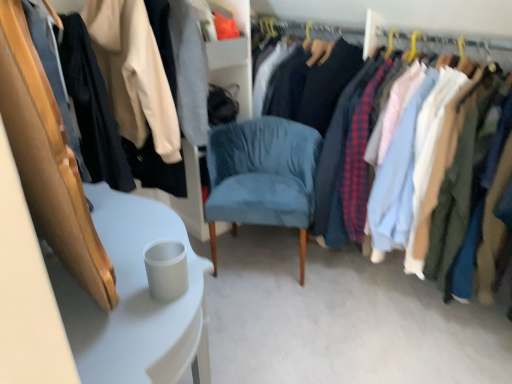
Find the location of a particular element. matte black jacket at upper left, positioned as the 1th closet in left-to-right order is located at coordinates (48, 161).

In order to face matte black jacket at upper left, the second closet from the right, should I rotate leftwards or rightwards?

To align with it, rotate left about 16.623°.

What do you see at coordinates (262, 176) in the screenshot?
I see `suede blue chair at center` at bounding box center [262, 176].

At what (x,y) coordinates should I click in order to perform the action: click on matte fabric shirts at right, the 2th closet when ordered from left to right. Please return your answer as a coordinate pair (x, y). Looking at the image, I should click on (471, 194).

Based on the photo, which is correct: matte fabric shirts at right, the 2th closet when ordered from left to right, is inside white glossy table at lower left, or outside of it?

matte fabric shirts at right, the 2th closet when ordered from left to right, is not inside white glossy table at lower left, it's outside.

Visually, is matte fabric shirts at right, the 1th closet viewed from the right, positioned to the left or to the right of white glossy table at lower left?

In the image, matte fabric shirts at right, the 1th closet viewed from the right, appears on the right side of white glossy table at lower left.

At what (x,y) coordinates should I click in order to perform the action: click on table below the matte black jacket at upper left, the second closet from the right (from a real-world perspective). Please return your answer as a coordinate pair (x, y). This screenshot has height=384, width=512. Looking at the image, I should click on (134, 300).

Is matte black jacket at upper left, the second closet from the right, positioned behind white glossy table at lower left?

Yes, it is behind white glossy table at lower left.

Considering the relative sizes of matte black jacket at upper left, positioned as the 1th closet in left-to-right order, and white glossy table at lower left in the image provided, is matte black jacket at upper left, positioned as the 1th closet in left-to-right order, shorter than white glossy table at lower left?

No.

Is point (316, 163) less distant than point (162, 375)?

No.

Is suede blue chair at center wider than white glossy table at lower left?

Yes, suede blue chair at center is wider than white glossy table at lower left.

Between suede blue chair at center and white glossy table at lower left, which one appears on the left side from the viewer's perspective?

Positioned to the left is white glossy table at lower left.

Are suede blue chair at center and white glossy table at lower left located far from each other?

suede blue chair at center is actually quite close to white glossy table at lower left.

From the image's perspective, between matte fabric shirts at right, the 1th closet viewed from the right, and suede blue chair at center, who is located below?

suede blue chair at center, from the image's perspective.

From a real-world perspective, which is physically above, matte fabric shirts at right, the 1th closet viewed from the right, or suede blue chair at center?

matte fabric shirts at right, the 1th closet viewed from the right.

How many degrees apart are the facing directions of matte fabric shirts at right, the 2th closet when ordered from left to right, and suede blue chair at center?

The angle between the facing direction of matte fabric shirts at right, the 2th closet when ordered from left to right, and the facing direction of suede blue chair at center is 43.8 degrees.

Is suede blue chair at center a part of matte fabric shirts at right, the 2th closet when ordered from left to right?

No, matte fabric shirts at right, the 2th closet when ordered from left to right, does not contain suede blue chair at center.

From a real-world perspective, who is located lower, matte black jacket at upper left, the second closet from the right, or matte fabric shirts at right, the 2th closet when ordered from left to right?

matte fabric shirts at right, the 2th closet when ordered from left to right, from a real-world perspective.

Is matte black jacket at upper left, the second closet from the right, oriented towards matte fabric shirts at right, the 2th closet when ordered from left to right?

No.

Based on their positions, is matte black jacket at upper left, the second closet from the right, located to the left or right of matte fabric shirts at right, the 1th closet viewed from the right?

From the image, it's evident that matte black jacket at upper left, the second closet from the right, is to the left of matte fabric shirts at right, the 1th closet viewed from the right.

Considering the sizes of matte black jacket at upper left, positioned as the 1th closet in left-to-right order, and matte fabric shirts at right, the 2th closet when ordered from left to right, in the image, is matte black jacket at upper left, positioned as the 1th closet in left-to-right order, wider or thinner than matte fabric shirts at right, the 2th closet when ordered from left to right,?

Clearly, matte black jacket at upper left, positioned as the 1th closet in left-to-right order, has less width compared to matte fabric shirts at right, the 2th closet when ordered from left to right.

Which object is closer to the camera taking this photo, suede blue chair at center or matte fabric shirts at right, the 1th closet viewed from the right?

matte fabric shirts at right, the 1th closet viewed from the right, is in front.

Looking at this image, can you confirm if suede blue chair at center is positioned to the right of matte fabric shirts at right, the 2th closet when ordered from left to right?

Incorrect, suede blue chair at center is not on the right side of matte fabric shirts at right, the 2th closet when ordered from left to right.

From the image's perspective, is suede blue chair at center positioned above or below matte fabric shirts at right, the 1th closet viewed from the right?

Based on their image positions, suede blue chair at center is located beneath matte fabric shirts at right, the 1th closet viewed from the right.

Can you tell me how much suede blue chair at center and matte fabric shirts at right, the 1th closet viewed from the right, differ in facing direction?

They differ by 43.8 degrees in their facing directions.

Which is more to the left, matte black jacket at upper left, the second closet from the right, or suede blue chair at center?

Positioned to the left is matte black jacket at upper left, the second closet from the right.

Is matte black jacket at upper left, positioned as the 1th closet in left-to-right order, oriented towards suede blue chair at center?

No, matte black jacket at upper left, positioned as the 1th closet in left-to-right order, is not oriented towards suede blue chair at center.

How many degrees apart are the facing directions of matte black jacket at upper left, the second closet from the right, and suede blue chair at center?

They differ by 48.2 degrees in their facing directions.

Does matte black jacket at upper left, positioned as the 1th closet in left-to-right order, have a lesser width compared to suede blue chair at center?

Incorrect, the width of matte black jacket at upper left, positioned as the 1th closet in left-to-right order, is not less than that of suede blue chair at center.

At what (x,y) coordinates should I click in order to perform the action: click on table lying in front of the matte fabric shirts at right, the 2th closet when ordered from left to right. Please return your answer as a coordinate pair (x, y). The height and width of the screenshot is (384, 512). Looking at the image, I should click on (134, 300).

The height and width of the screenshot is (384, 512). What are the coordinates of `table below the matte black jacket at upper left, positioned as the 1th closet in left-to-right order (from a real-world perspective)` in the screenshot? It's located at (134, 300).

Considering their positions, is matte black jacket at upper left, positioned as the 1th closet in left-to-right order, positioned further to white glossy table at lower left than matte fabric shirts at right, the 2th closet when ordered from left to right?

matte fabric shirts at right, the 2th closet when ordered from left to right, is positioned further to the anchor white glossy table at lower left.

Estimate the real-world distances between objects in this image. Which object is closer to white glossy table at lower left, suede blue chair at center or matte fabric shirts at right, the 1th closet viewed from the right?

suede blue chair at center is closer to white glossy table at lower left.

From the image, which object appears to be nearer to matte fabric shirts at right, the 2th closet when ordered from left to right, matte black jacket at upper left, the second closet from the right, or white glossy table at lower left?

white glossy table at lower left lies closer to matte fabric shirts at right, the 2th closet when ordered from left to right, than the other object.

When comparing their distances from suede blue chair at center, does matte fabric shirts at right, the 2th closet when ordered from left to right, or white glossy table at lower left seem closer?

matte fabric shirts at right, the 2th closet when ordered from left to right, is closer to suede blue chair at center.

From the image, which object appears to be nearer to matte fabric shirts at right, the 2th closet when ordered from left to right, white glossy table at lower left or matte black jacket at upper left, the second closet from the right?

The object closer to matte fabric shirts at right, the 2th closet when ordered from left to right, is white glossy table at lower left.

Considering their positions, is white glossy table at lower left positioned further to matte fabric shirts at right, the 1th closet viewed from the right, than suede blue chair at center?

The object further to matte fabric shirts at right, the 1th closet viewed from the right, is white glossy table at lower left.

In the scene shown: Which object lies further to the anchor point matte black jacket at upper left, positioned as the 1th closet in left-to-right order, white glossy table at lower left or matte fabric shirts at right, the 1th closet viewed from the right?

The object further to matte black jacket at upper left, positioned as the 1th closet in left-to-right order, is matte fabric shirts at right, the 1th closet viewed from the right.

Considering their positions, is matte black jacket at upper left, the second closet from the right, positioned further to matte fabric shirts at right, the 2th closet when ordered from left to right, than suede blue chair at center?

Based on the image, matte black jacket at upper left, the second closet from the right, appears to be further to matte fabric shirts at right, the 2th closet when ordered from left to right.

I want to click on table between matte black jacket at upper left, positioned as the 1th closet in left-to-right order, and matte fabric shirts at right, the 1th closet viewed from the right, from left to right, so click(134, 300).

Where is `chair situated between matte black jacket at upper left, positioned as the 1th closet in left-to-right order, and matte fabric shirts at right, the 2th closet when ordered from left to right, from left to right`? This screenshot has width=512, height=384. chair situated between matte black jacket at upper left, positioned as the 1th closet in left-to-right order, and matte fabric shirts at right, the 2th closet when ordered from left to right, from left to right is located at coordinates (262, 176).

Where is `chair located between white glossy table at lower left and matte fabric shirts at right, the 2th closet when ordered from left to right, in the left-right direction`? chair located between white glossy table at lower left and matte fabric shirts at right, the 2th closet when ordered from left to right, in the left-right direction is located at coordinates (262, 176).